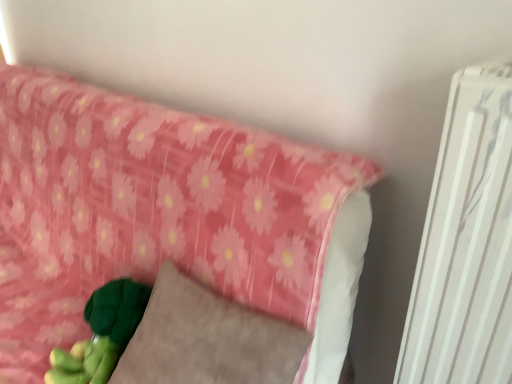
Image resolution: width=512 pixels, height=384 pixels. What do you see at coordinates (149, 209) in the screenshot? I see `pink fabric pillow at upper left` at bounding box center [149, 209].

Measure the distance between pink fabric pillow at upper left and camera.

The depth of pink fabric pillow at upper left is 26.92 inches.

You are a GUI agent. You are given a task and a screenshot of the screen. Output one action in this format:
    pyautogui.click(x=<x>, y=<y>)
    Task: Click on the pink fabric pillow at upper left
    The width and height of the screenshot is (512, 384).
    Given the screenshot: What is the action you would take?
    pyautogui.click(x=149, y=209)

What is the approximate width of pink fabric pillow at upper left?

pink fabric pillow at upper left is 23.71 inches wide.

Describe the element at coordinates (207, 339) in the screenshot. I see `velvety gray pillow at lower left` at that location.

You are a GUI agent. You are given a task and a screenshot of the screen. Output one action in this format:
    pyautogui.click(x=<x>, y=<y>)
    Task: Click on the velvety gray pillow at lower left
    This screenshot has height=384, width=512.
    Given the screenshot: What is the action you would take?
    coord(207,339)

Locate an element on the screen. The height and width of the screenshot is (384, 512). pink fabric pillow at upper left is located at coordinates (149, 209).

Consider the image. Can you confirm if pink fabric pillow at upper left is positioned to the left of velvety gray pillow at lower left?

Result: Correct, you'll find pink fabric pillow at upper left to the left of velvety gray pillow at lower left.

Considering the positions of objects pink fabric pillow at upper left and velvety gray pillow at lower left in the image provided, who is behind, pink fabric pillow at upper left or velvety gray pillow at lower left?

velvety gray pillow at lower left is more distant.

Which point is more distant from viewer, (45, 283) or (187, 360)?

The point (45, 283) is farther from the camera.

From the image's perspective, which one is positioned lower, pink fabric pillow at upper left or velvety gray pillow at lower left?

velvety gray pillow at lower left appears lower in the image.

From a real-world perspective, which object rests below the other?

pink fabric pillow at upper left, from a real-world perspective.

Can you confirm if pink fabric pillow at upper left is thinner than velvety gray pillow at lower left?

No.

Who is taller, pink fabric pillow at upper left or velvety gray pillow at lower left?

pink fabric pillow at upper left is taller.

Considering the sizes of objects pink fabric pillow at upper left and velvety gray pillow at lower left in the image provided, who is bigger, pink fabric pillow at upper left or velvety gray pillow at lower left?

pink fabric pillow at upper left.

Is pink fabric pillow at upper left not within velvety gray pillow at lower left?

Yes, pink fabric pillow at upper left is outside of velvety gray pillow at lower left.

Is pink fabric pillow at upper left directly adjacent to velvety gray pillow at lower left?

pink fabric pillow at upper left and velvety gray pillow at lower left are not in contact.

Is pink fabric pillow at upper left aimed at velvety gray pillow at lower left?

Yes, pink fabric pillow at upper left faces towards velvety gray pillow at lower left.

Can you tell me how much pink fabric pillow at upper left and velvety gray pillow at lower left differ in facing direction?

The angle between the facing direction of pink fabric pillow at upper left and the facing direction of velvety gray pillow at lower left is 4.35 degrees.

Identify the location of pillow behind the pink fabric pillow at upper left. The height and width of the screenshot is (384, 512). (207, 339).

Between velvety gray pillow at lower left and pink fabric pillow at upper left, which one appears on the right side from the viewer's perspective?

Positioned to the right is velvety gray pillow at lower left.

Relative to pink fabric pillow at upper left, is velvety gray pillow at lower left in front or behind?

Visually, velvety gray pillow at lower left is located behind pink fabric pillow at upper left.

Between point (179, 314) and point (217, 251), which one is positioned behind?

Point (217, 251)

From the image's perspective, is velvety gray pillow at lower left located beneath pink fabric pillow at upper left?

Indeed, from the image's perspective, velvety gray pillow at lower left is shown beneath pink fabric pillow at upper left.

From a real-world perspective, is velvety gray pillow at lower left located beneath pink fabric pillow at upper left?

Incorrect, from a real-world perspective, velvety gray pillow at lower left is higher than pink fabric pillow at upper left.

Between velvety gray pillow at lower left and pink fabric pillow at upper left, which one has smaller width?

With smaller width is velvety gray pillow at lower left.

Which of these two, velvety gray pillow at lower left or pink fabric pillow at upper left, stands taller?

pink fabric pillow at upper left.

Is velvety gray pillow at lower left bigger than pink fabric pillow at upper left?

Actually, velvety gray pillow at lower left might be smaller than pink fabric pillow at upper left.

Would you say velvety gray pillow at lower left is inside or outside pink fabric pillow at upper left?

velvety gray pillow at lower left is spatially positioned inside pink fabric pillow at upper left.

Is velvety gray pillow at lower left touching pink fabric pillow at upper left?

No, velvety gray pillow at lower left is not beside pink fabric pillow at upper left.

Is velvety gray pillow at lower left looking in the opposite direction of pink fabric pillow at upper left?

That's right, velvety gray pillow at lower left is facing away from pink fabric pillow at upper left.

Looking at this image, how distant is velvety gray pillow at lower left from pink fabric pillow at upper left?

velvety gray pillow at lower left is 10.74 inches away from pink fabric pillow at upper left.

Locate an element on the screen. furniture below the velvety gray pillow at lower left (from a real-world perspective) is located at coordinates (149, 209).

Locate an element on the screen. furniture below the velvety gray pillow at lower left (from a real-world perspective) is located at coordinates (149, 209).

You are a GUI agent. You are given a task and a screenshot of the screen. Output one action in this format:
    pyautogui.click(x=<x>, y=<y>)
    Task: Click on the furniture in front of the velvety gray pillow at lower left
    This screenshot has height=384, width=512.
    Given the screenshot: What is the action you would take?
    pyautogui.click(x=149, y=209)